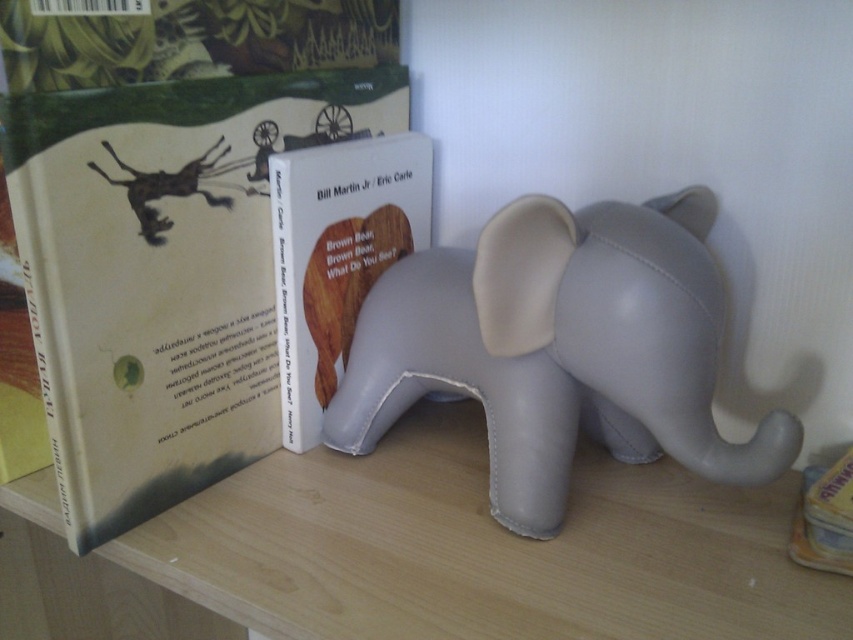
You are organizing a shelf and need to place a new item between the white paper at center and the gray matte elephant at center. Where should you place it to ensure it is between them?

The white paper at center is to the left of the gray matte elephant at center, so placing the new item between them would require positioning it to the right of the white paper at center and to the left of the gray matte elephant at center.

You are organizing a shelf and need to place a new item between the gray matte elephant at center and the matte white book at center. Can you determine which side of the elephant the book is located on?

The matte white book at center is behind the gray matte elephant at center, so placing the new item between them would require positioning it to the side of the elephant opposite the book.

You are a delivery person who needs to place a new item on the shelf. The item is 7 inches long. There is a space between the gray matte elephant at center and the matte white book at center. Can the item fit in that space?

The gray matte elephant at center and the matte white book at center are 6.57 inches apart from each other. Since the item is 7 inches long, it cannot fit in that space because the space is smaller than the item.